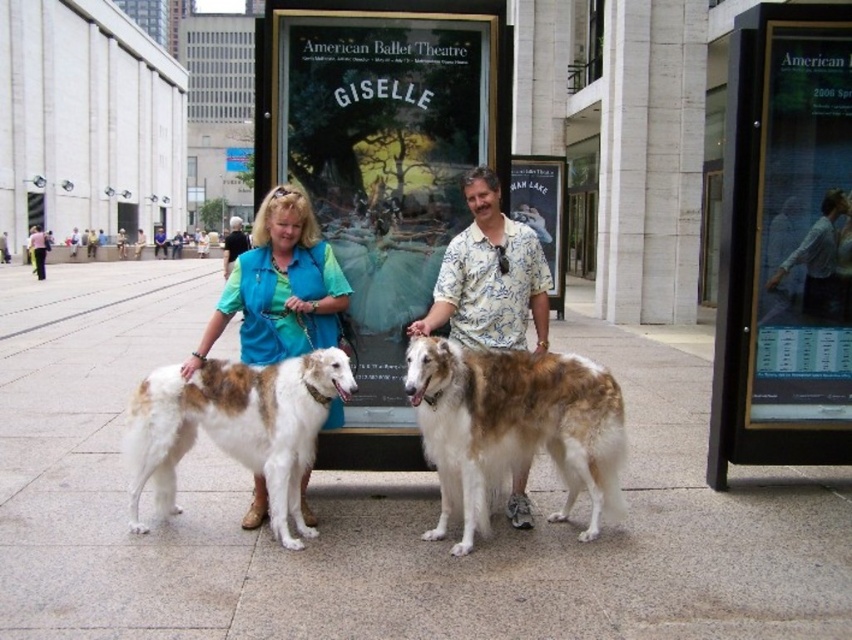
Which is more to the left, white marble pavement at center or brown and white fur at center?

white marble pavement at center is more to the left.

This screenshot has height=640, width=852. Find the location of `white marble pavement at center`. white marble pavement at center is located at coordinates (376, 508).

Can you confirm if blue fabric vest at center is shorter than fluffy brown dog at center?

Incorrect, blue fabric vest at center's height does not fall short of fluffy brown dog at center's.

Between blue fabric vest at center and fluffy brown dog at center, which one appears on the right side from the viewer's perspective?

fluffy brown dog at center is more to the right.

Which is in front, point (239, 305) or point (527, 268)?

Point (239, 305) is more forward.

Find the location of `blue fabric vest at center`. blue fabric vest at center is located at coordinates (280, 285).

Who is taller, floral shirt at center or blue fabric shirt at center?

Standing taller between the two is blue fabric shirt at center.

Describe the element at coordinates (488, 276) in the screenshot. I see `floral shirt at center` at that location.

Image resolution: width=852 pixels, height=640 pixels. In order to click on floral shirt at center in this screenshot , I will do `click(488, 276)`.